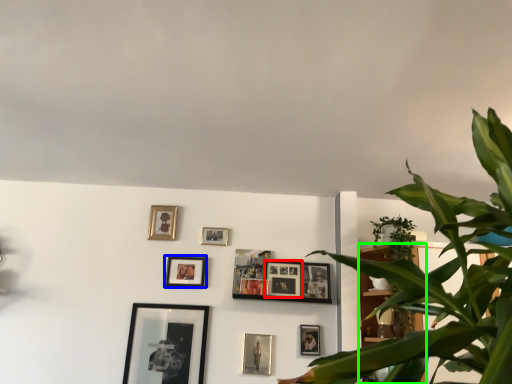
Question: Which object is the farthest from picture frame (highlighted by a red box)? Choose among these: picture frame (highlighted by a blue box) or bookshelf (highlighted by a green box).

Choices:
 (A) picture frame
 (B) bookshelf

Answer: (A)